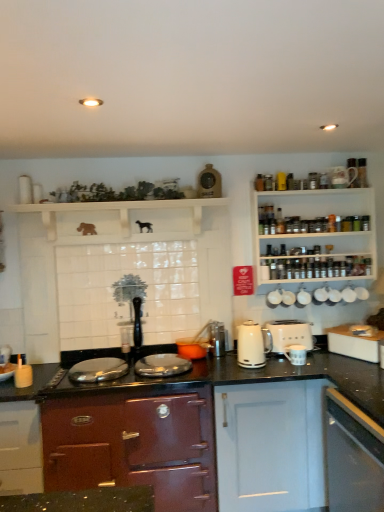
The image size is (384, 512). I want to click on vacant space that is to the left of white ceramic mug at lower center, which ranks as the 3th appliance in right-to-left order, so click(x=281, y=369).